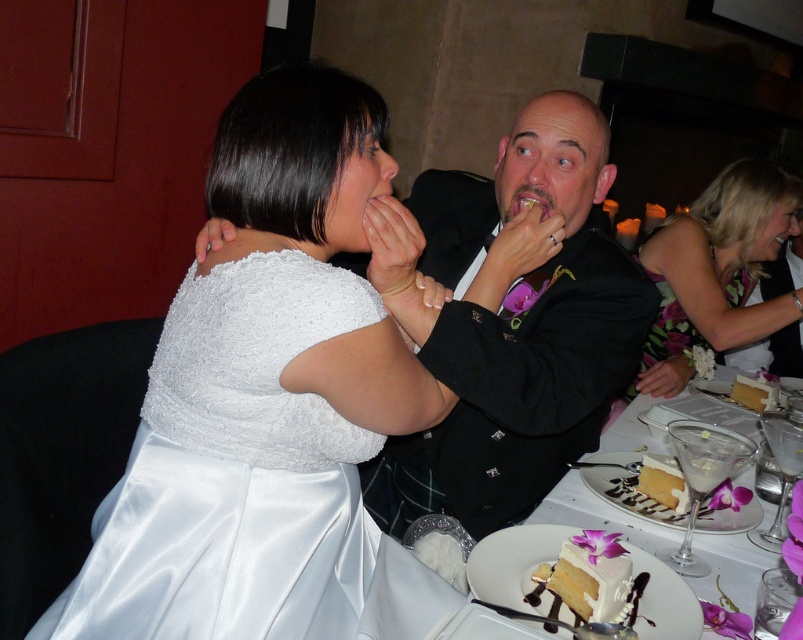
Question: Where is floral dress at right located in relation to white frosted cake at center in the image?

Choices:
 (A) above
 (B) below

Answer: (A)

Question: Does white frosted cake at center lie in front of white creamy cake at center?

Choices:
 (A) yes
 (B) no

Answer: (A)

Question: Among these objects, which one is farthest from the camera?

Choices:
 (A) white frosted cake at lower right
 (B) yellow sponge cake at lower right

Answer: (B)

Question: Which point is closer to the camera?

Choices:
 (A) white frosted cake at lower right
 (B) floral dress at right

Answer: (A)

Question: Does white frosted cake at center appear on the right side of white frosted cake at lower right?

Choices:
 (A) no
 (B) yes

Answer: (A)

Question: Which object is positioned farthest from the black satin suit at center?

Choices:
 (A) white frosted cake at lower right
 (B) white creamy cake at center

Answer: (B)